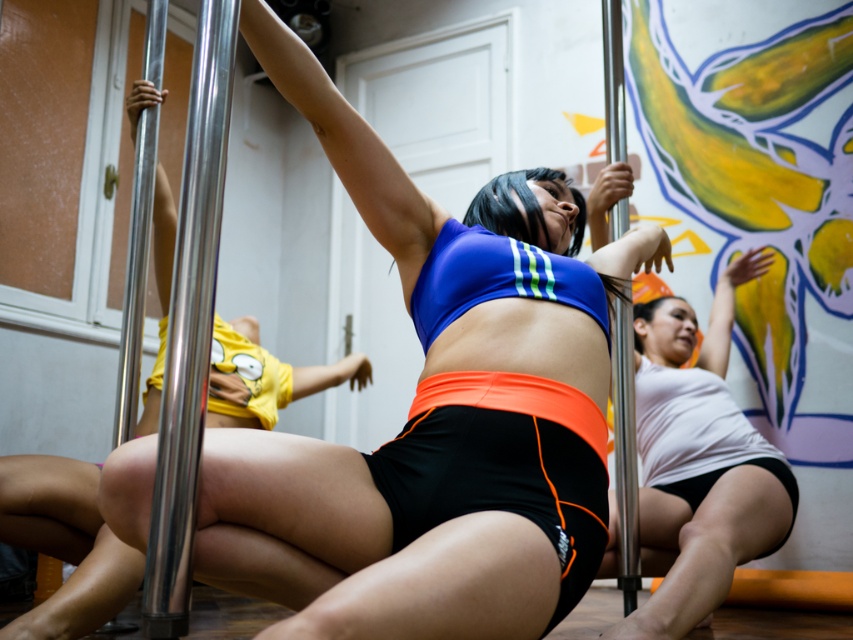
Question: Which object is the closest to the white matte tank top at center?

Choices:
 (A) matte blue sports bra at center
 (B) matte black pole at left
 (C) polished silver pole at left
 (D) silver metallic pole at center

Answer: (D)

Question: Which object is the farthest from the polished silver pole at left?

Choices:
 (A) matte black pole at left
 (B) matte blue sports bra at center

Answer: (A)

Question: Which point appears closest to the camera in this image?

Choices:
 (A) (161, 390)
 (B) (216, 436)
 (C) (218, 392)
 (D) (689, 564)

Answer: (A)

Question: Does matte blue sports bra at center come behind white matte tank top at center?

Choices:
 (A) no
 (B) yes

Answer: (A)

Question: Is matte blue sports bra at center positioned behind polished silver pole at left?

Choices:
 (A) yes
 (B) no

Answer: (B)

Question: Is white matte tank top at center to the left of matte black pole at left from the viewer's perspective?

Choices:
 (A) no
 (B) yes

Answer: (A)